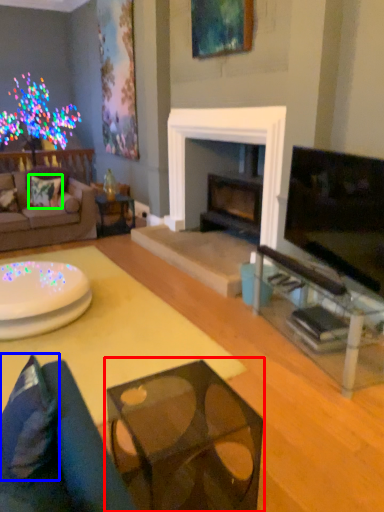
Question: Which object is positioned closest to table (highlighted by a red box)? Select from pillow (highlighted by a blue box) and pillow (highlighted by a green box).

Choices:
 (A) pillow
 (B) pillow

Answer: (A)